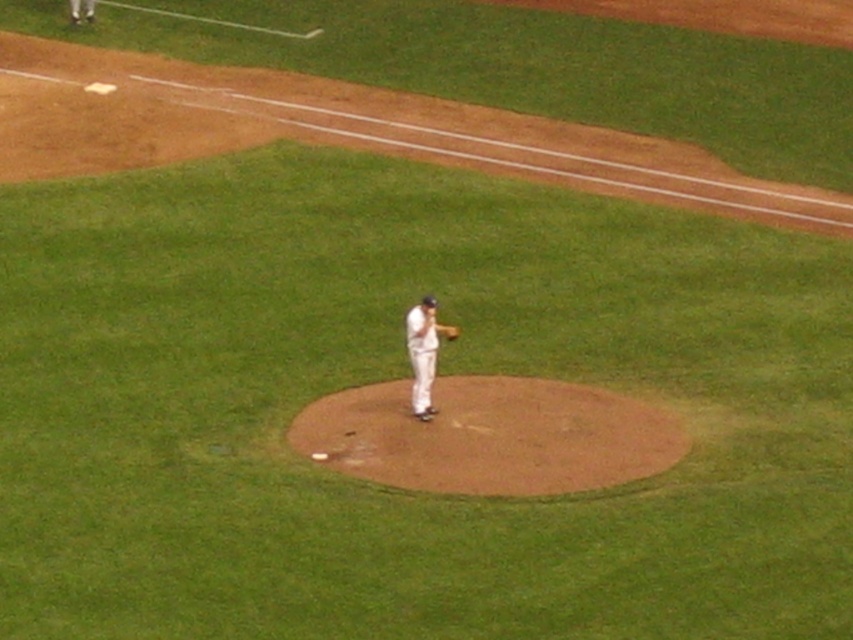
How far apart are white fabric pants at upper left and brown leather glove at center?

They are 63.46 feet apart.

Does point (76, 10) lie in front of point (440, 326)?

No, it is not.

What do you see at coordinates (83, 10) in the screenshot?
I see `white fabric pants at upper left` at bounding box center [83, 10].

In order to click on white fabric pants at upper left in this screenshot , I will do `click(83, 10)`.

From the picture: Which is more to the right, white uniform at center or brown leather glove at center?

brown leather glove at center is more to the right.

Does point (419, 358) come farther from viewer compared to point (445, 326)?

No, (419, 358) is in front of (445, 326).

Where is `white uniform at center`? The width and height of the screenshot is (853, 640). white uniform at center is located at coordinates (424, 353).

Which is below, brown dirt mound at center or white fabric pants at upper left?

brown dirt mound at center is lower down.

Is point (599, 429) closer to camera compared to point (93, 0)?

Yes, it is.

Does point (553, 440) come closer to viewer compared to point (90, 12)?

Yes, point (553, 440) is closer to viewer.

You are a GUI agent. You are given a task and a screenshot of the screen. Output one action in this format:
    pyautogui.click(x=<x>, y=<y>)
    Task: Click on the brown dirt mound at center
    The height and width of the screenshot is (640, 853).
    Given the screenshot: What is the action you would take?
    pyautogui.click(x=491, y=436)